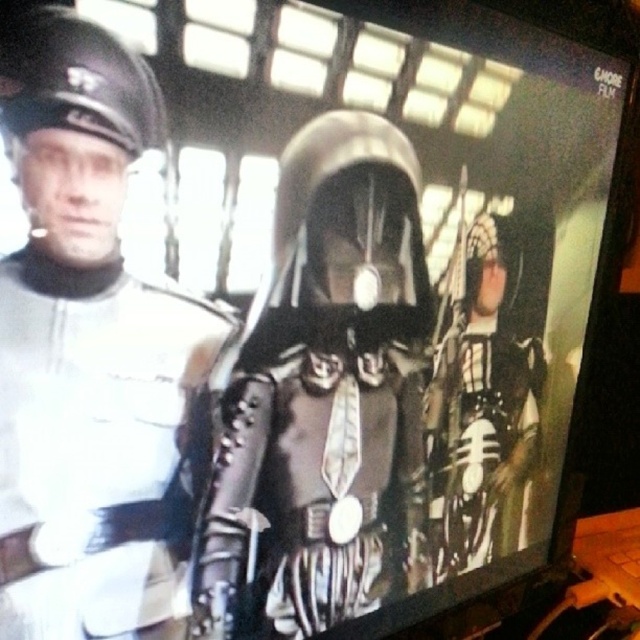
Which of these two, shiny silver armor at center or black leather armor at center, stands shorter?

black leather armor at center is shorter.

Can you confirm if shiny silver armor at center is shorter than black leather armor at center?

In fact, shiny silver armor at center may be taller than black leather armor at center.

Does point (314, 618) come in front of point (541, 257)?

Yes, point (314, 618) is closer to viewer.

This screenshot has width=640, height=640. What are the coordinates of `shiny silver armor at center` in the screenshot? It's located at (324, 392).

Measure the distance between white matte uniform at left and camera.

They are 14.24 inches apart.

Is white matte uniform at left positioned behind black leather armor at center?

No.

The height and width of the screenshot is (640, 640). What do you see at coordinates (90, 353) in the screenshot?
I see `white matte uniform at left` at bounding box center [90, 353].

Find the location of a particular element. The width and height of the screenshot is (640, 640). white matte uniform at left is located at coordinates (90, 353).

Is white matte uniform at left to the left of shiny silver armor at center from the viewer's perspective?

Indeed, white matte uniform at left is positioned on the left side of shiny silver armor at center.

Who is taller, white matte uniform at left or shiny silver armor at center?

shiny silver armor at center

Where is `white matte uniform at left`? Image resolution: width=640 pixels, height=640 pixels. white matte uniform at left is located at coordinates (90, 353).

Identify the location of white matte uniform at left. (90, 353).